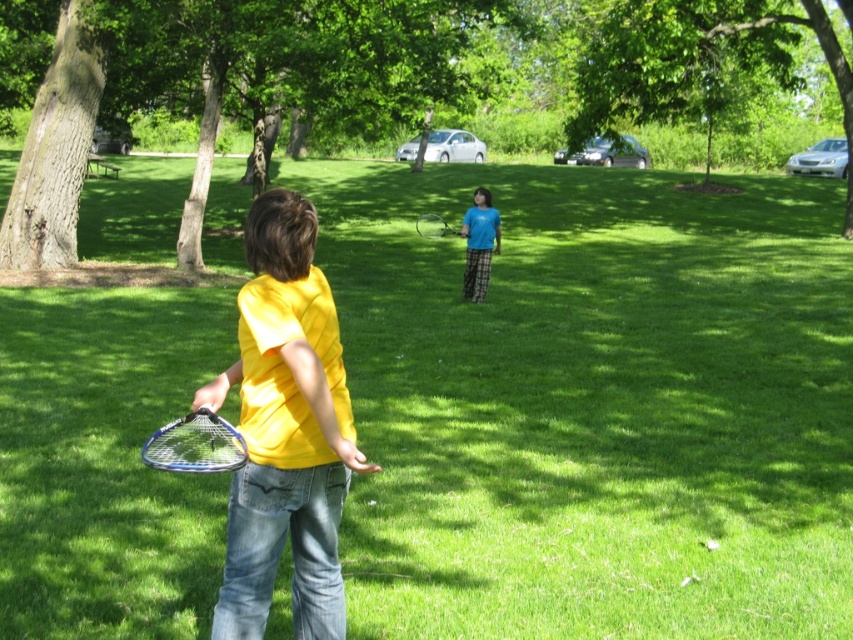
You are a park maintenance worker who needs to place a 100 feet long fence between the green leafy tree at upper center and the blue metallic tennis racket at lower left. Can you fit the fence between them?

The distance between the green leafy tree at upper center and the blue metallic tennis racket at lower left is 92.88 feet, so the 100 feet long fence is longer than the available space. Therefore, it cannot be placed between them.

You are standing in the park and see the green leafy tree at upper center and the blue metallic tennis racket at center. Which object is higher in the image?

The green leafy tree at upper center is above the blue metallic tennis racket at center, so the green leafy tree at upper center is higher.